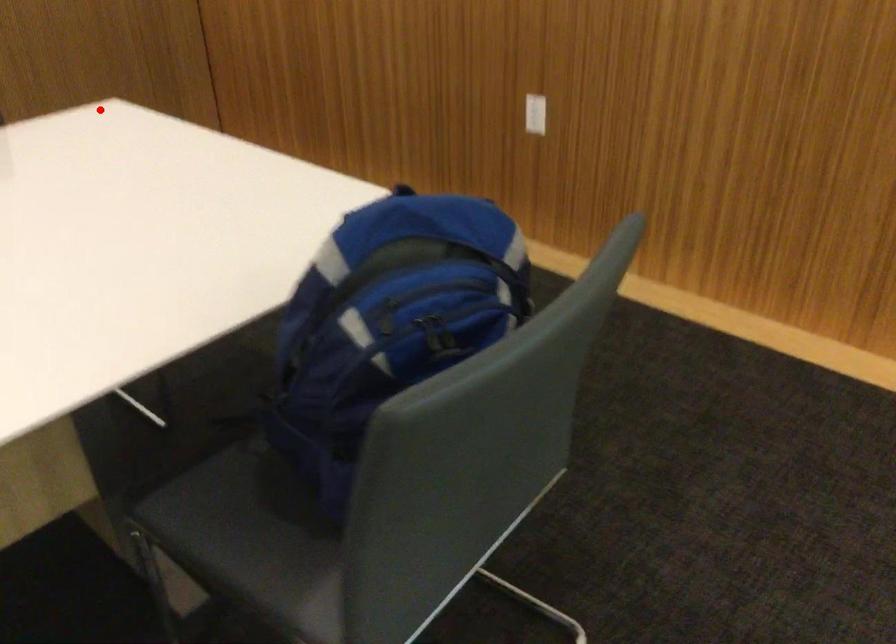
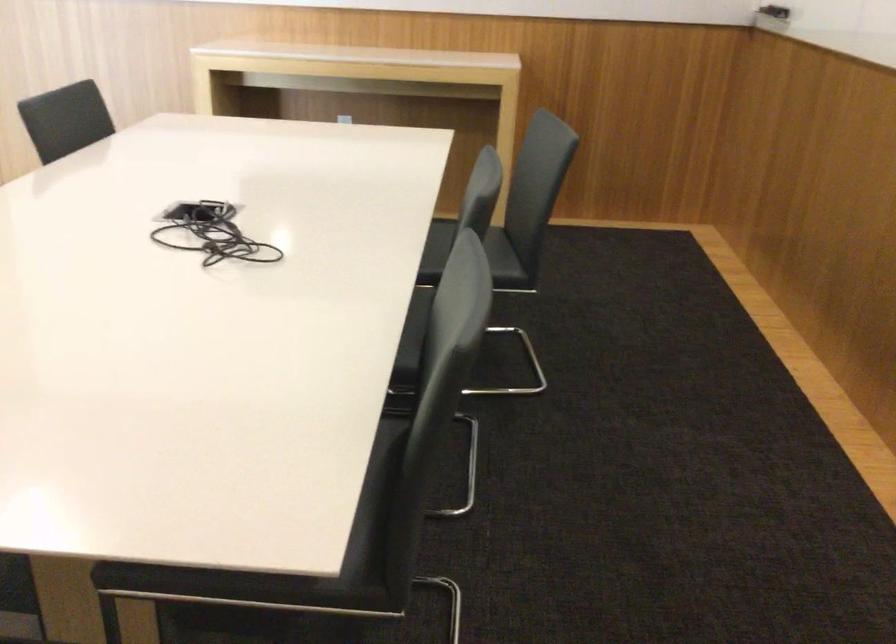
Question: I am providing you with two images of the same scene from different viewpoints. Image1 has a red point marked. In image2, the corresponding 3D location appears at what relative position? Reply with the corresponding letter.

Choices:
 (A) Closer
 (B) Farther

Answer: (A)